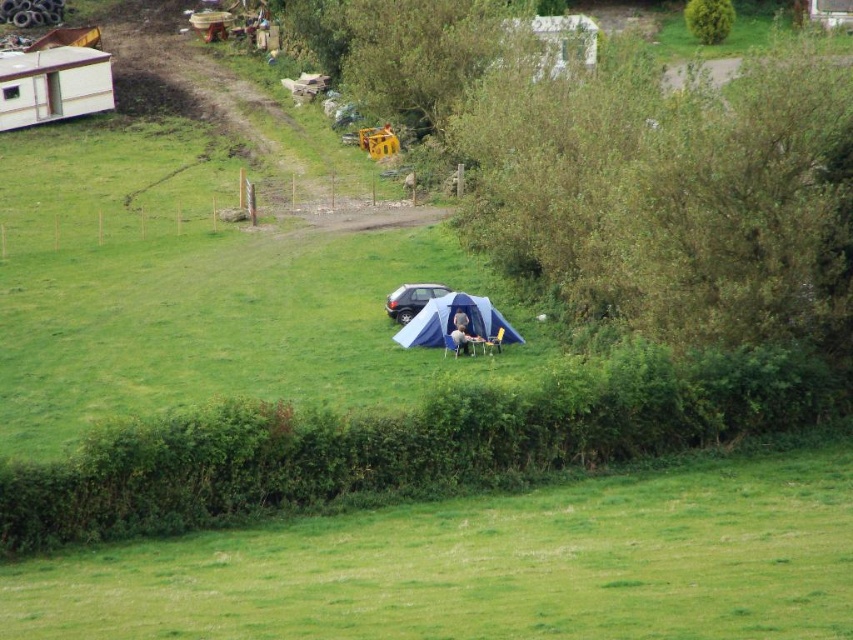
You are standing at the entrance of the dirt path in the midground. You want to walk directly to the blue fabric tent at center. Which direction should you head?

The blue fabric tent at center is located at point (453, 323), so you should head towards the center of the image to reach it.

You are standing at the origin point of the coordinate system in this image. You want to move towards the satin silver car at center. What are the coordinates you need to move towards?

The coordinates you need to move towards are approximately 0.469 on the x axis and 0.483 on the y axis, as the satin silver car at center is located at point (410, 300).

You are planning to take a photo of the blue fabric tent at center and the satin silver car at center from the path. Which object will appear closer to the camera in the photo?

The blue fabric tent at center will appear closer to the camera in the photo because it is positioned in front of the satin silver car at center.